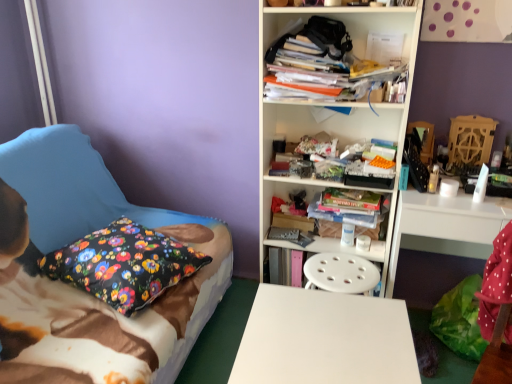
Find the location of a particular element. This screenshot has height=384, width=512. free space above white glossy computer desk at right (from a real-world perspective) is located at coordinates (468, 195).